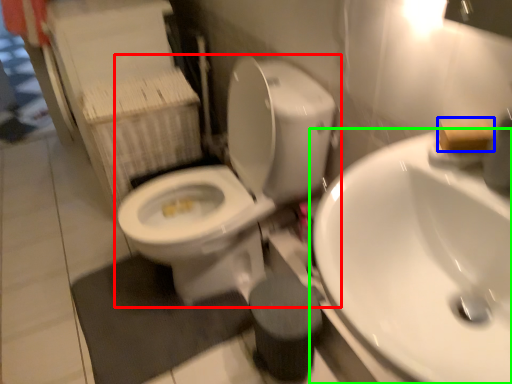
Question: Based on their relative distances, which object is nearer to toilet (highlighted by a red box)? Choose from soap (highlighted by a blue box) and sink (highlighted by a green box).

Choices:
 (A) soap
 (B) sink

Answer: (B)